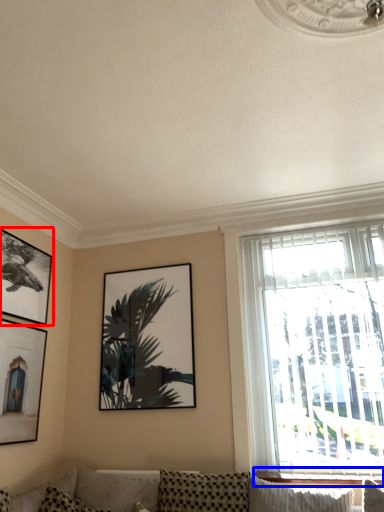
Question: Which point is closer to the camera, picture frame (highlighted by a red box) or window sill (highlighted by a blue box)?

Choices:
 (A) picture frame
 (B) window sill

Answer: (B)